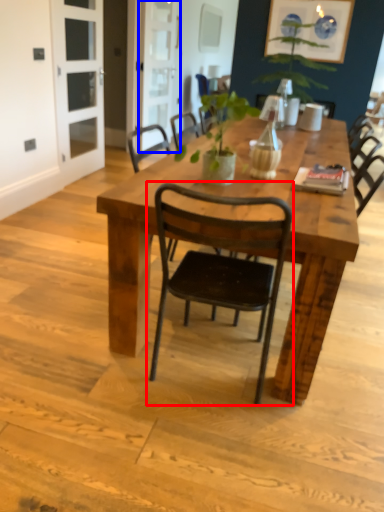
Question: Among these objects, which one is nearest to the camera, chair (highlighted by a red box) or screen door (highlighted by a blue box)?

Choices:
 (A) chair
 (B) screen door

Answer: (A)